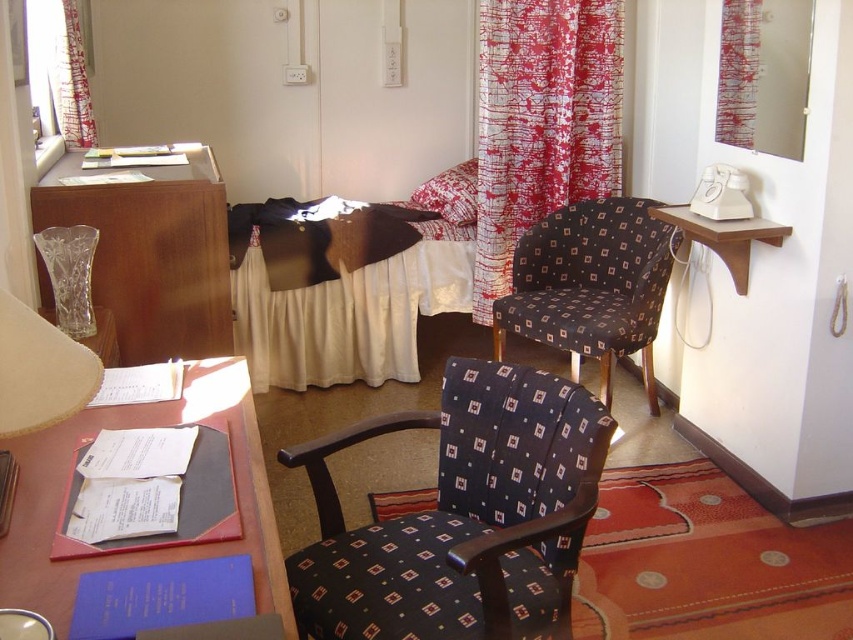
Question: Which of these objects is positioned closest to the red printed fabric curtain at upper right?

Choices:
 (A) transparent glass vase at left
 (B) red printed fabric curtain at upper left
 (C) red printed fabric curtain at upper center

Answer: (C)

Question: Among these points, which one is nearest to the camera?

Choices:
 (A) (84, 112)
 (B) (607, 243)
 (C) (596, 58)

Answer: (A)

Question: Does transparent glass vase at left have a greater width compared to matte glass lampshade at left?

Choices:
 (A) no
 (B) yes

Answer: (B)

Question: Can you confirm if red printed fabric curtain at upper center is bigger than red printed fabric curtain at upper right?

Choices:
 (A) yes
 (B) no

Answer: (A)

Question: Is the position of dark blue fabric swivel chair at center less distant than that of red printed fabric curtain at upper left?

Choices:
 (A) no
 (B) yes

Answer: (B)

Question: Which object is farther from the camera taking this photo?

Choices:
 (A) matte glass lampshade at left
 (B) transparent glass vase at left
 (C) red printed fabric curtain at upper center

Answer: (C)